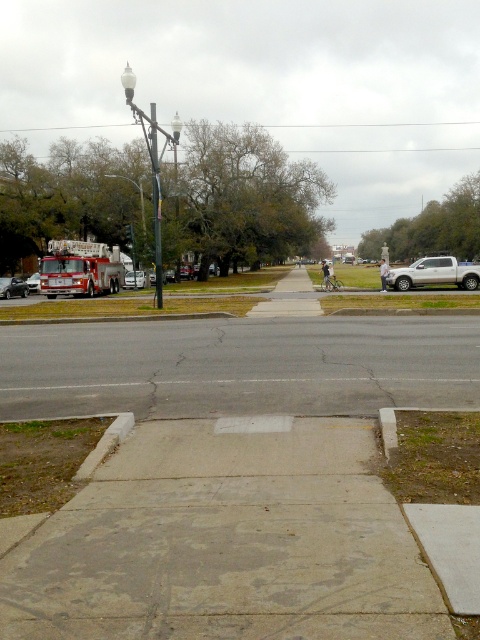
Can you confirm if metallic streetlight at upper left is bigger than metallic silver fire truck at left?

Indeed, metallic streetlight at upper left has a larger size compared to metallic silver fire truck at left.

Which is above, metallic streetlight at upper left or metallic silver fire truck at left?

Positioned higher is metallic streetlight at upper left.

Is point (141, 186) closer to viewer compared to point (29, 280)?

That is False.

Locate an element on the screen. metallic streetlight at upper left is located at coordinates (140, 195).

This screenshot has width=480, height=640. Describe the element at coordinates (227, 544) in the screenshot. I see `gray concrete sidewalk at center` at that location.

Is gray concrete sidewalk at center positioned behind matte red fire truck at left?

No, gray concrete sidewalk at center is in front of matte red fire truck at left.

Between point (69, 577) and point (26, 285), which one is positioned in front?

Positioned in front is point (69, 577).

Identify the location of gray concrete sidewalk at center. (227, 544).

Which of these two, gray concrete sidewalk at center or white glass lamp post at upper center, stands shorter?

Standing shorter between the two is gray concrete sidewalk at center.

This screenshot has height=640, width=480. What do you see at coordinates (227, 544) in the screenshot?
I see `gray concrete sidewalk at center` at bounding box center [227, 544].

This screenshot has height=640, width=480. Identify the location of gray concrete sidewalk at center. (227, 544).